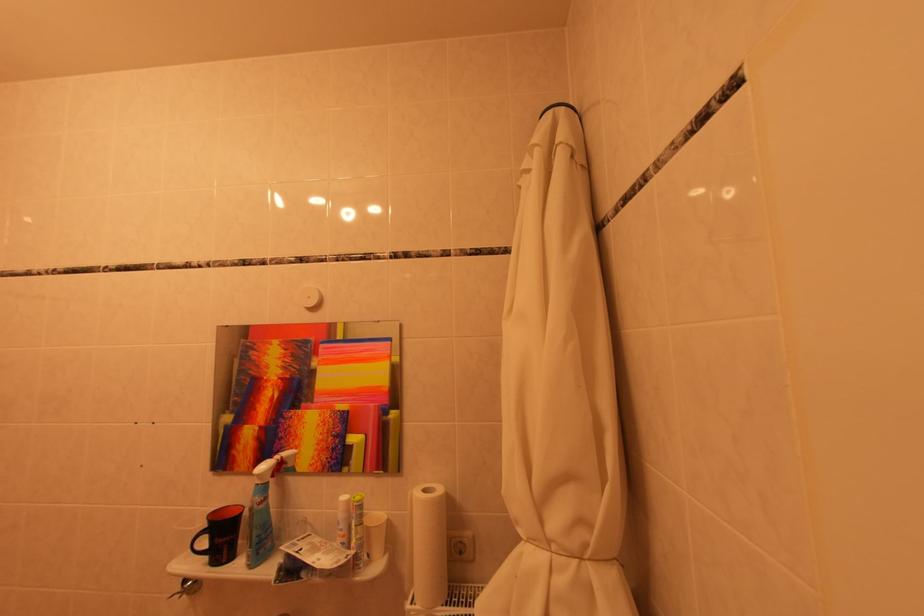
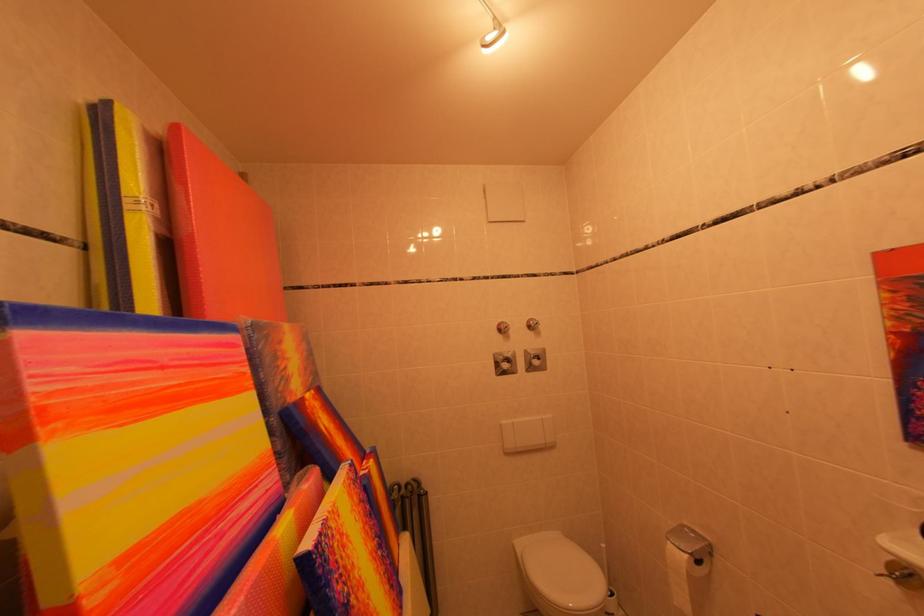
Question: The first image is from the beginning of the video and the second image is from the end. How did the camera likely rotate when shooting the video?

Choices:
 (A) Left
 (B) Right
 (C) Up
 (D) Down

Answer: (A)